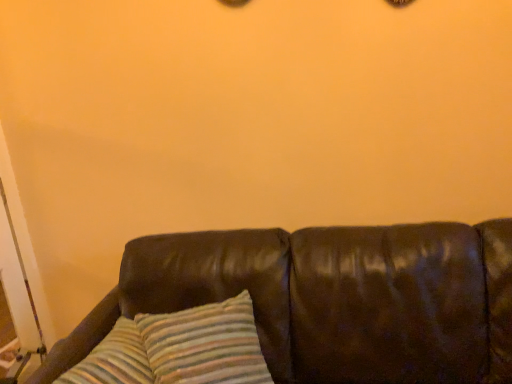
What do you see at coordinates (334, 299) in the screenshot? The height and width of the screenshot is (384, 512). I see `brown leather couch at center` at bounding box center [334, 299].

Locate an element on the screen. This screenshot has width=512, height=384. brown leather couch at center is located at coordinates (334, 299).

Locate an element on the screen. This screenshot has width=512, height=384. brown leather couch at center is located at coordinates click(334, 299).